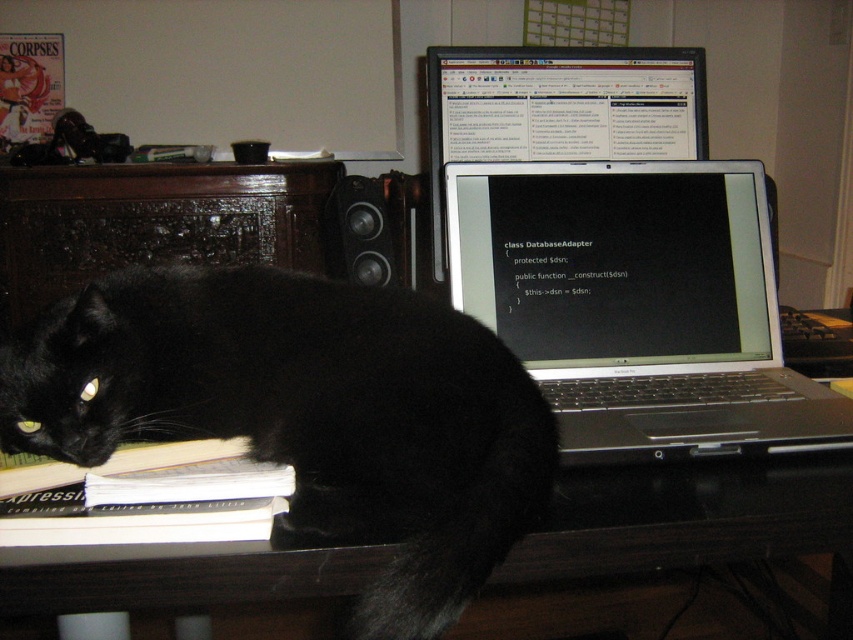
Is silver metallic laptop at center to the left of white paper book at lower left from the viewer's perspective?

In fact, silver metallic laptop at center is to the right of white paper book at lower left.

Locate an element on the screen. This screenshot has height=640, width=853. silver metallic laptop at center is located at coordinates (637, 305).

Where is `silver metallic laptop at center`? silver metallic laptop at center is located at coordinates (637, 305).

Is black wooden table at lower left thinner than black glossy laptop at upper center?

In fact, black wooden table at lower left might be wider than black glossy laptop at upper center.

In order to click on black wooden table at lower left in this screenshot , I will do `click(683, 516)`.

Can you confirm if black fur cat at left is positioned above black glossy laptop at upper center?

Actually, black fur cat at left is below black glossy laptop at upper center.

Is black fur cat at left wider than black glossy laptop at upper center?

Correct, the width of black fur cat at left exceeds that of black glossy laptop at upper center.

Where is `black fur cat at left`? Image resolution: width=853 pixels, height=640 pixels. black fur cat at left is located at coordinates (306, 413).

You are a GUI agent. You are given a task and a screenshot of the screen. Output one action in this format:
    pyautogui.click(x=<x>, y=<y>)
    Task: Click on the black fur cat at left
    The height and width of the screenshot is (640, 853).
    Given the screenshot: What is the action you would take?
    pyautogui.click(x=306, y=413)